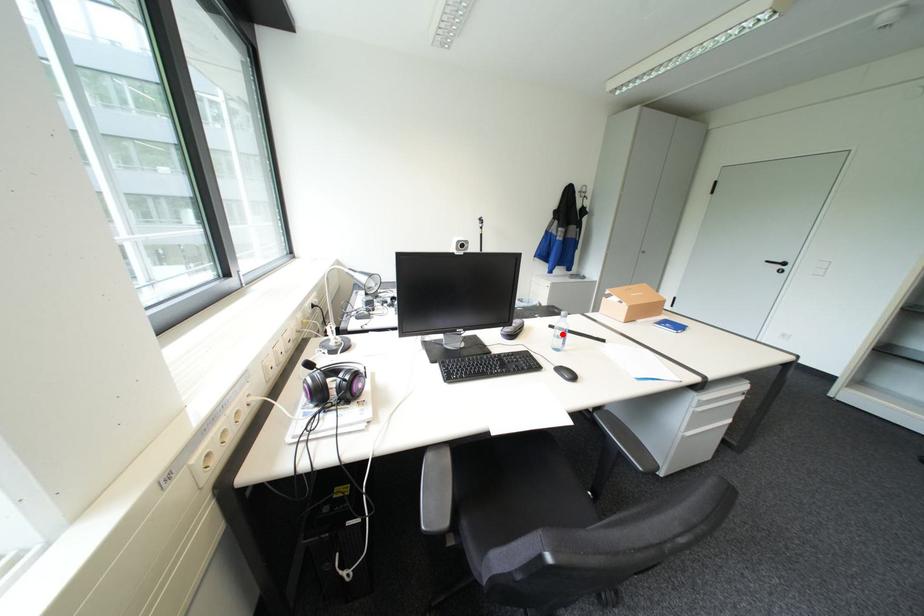
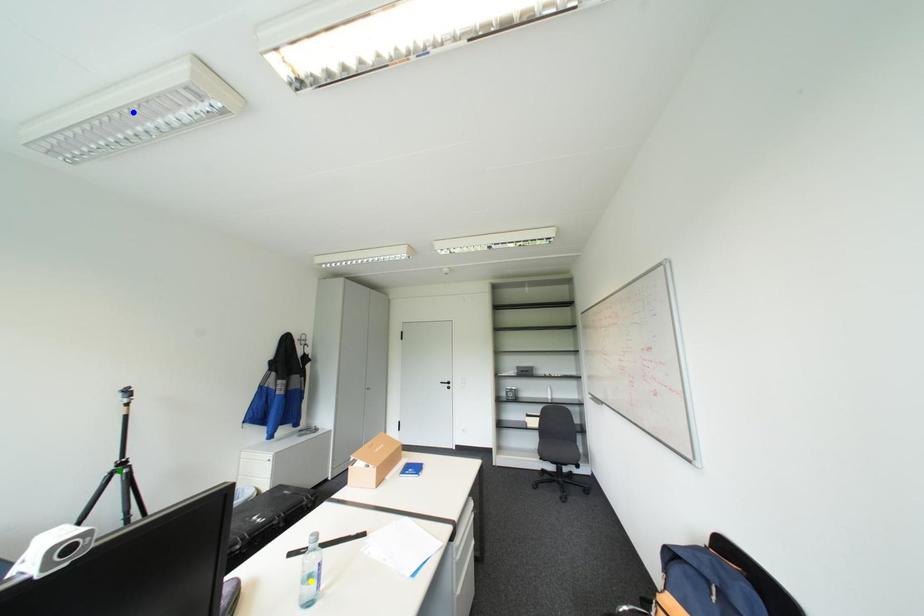
Question: I am providing you with two images of the same scene from different viewpoints. A red point is marked on the first image. You are given multiple points on the second image. In image 2, which mark is for the same physical point as the one in image 1?

Choices:
 (A) yellow point
 (B) blue point
 (C) green point

Answer: (A)